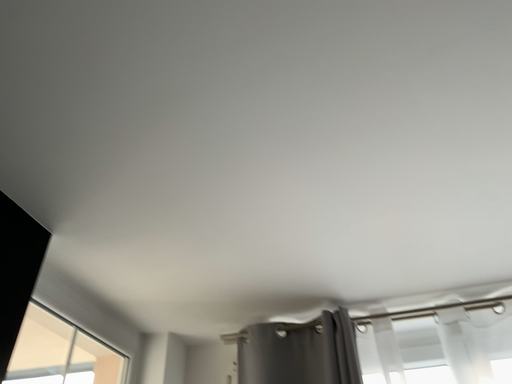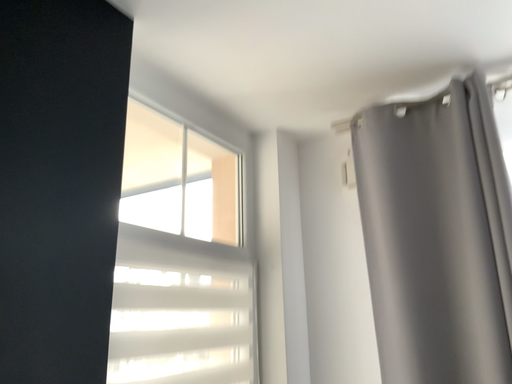
Question: Which way did the camera rotate in the video?

Choices:
 (A) rotated downward
 (B) rotated upward

Answer: (A)